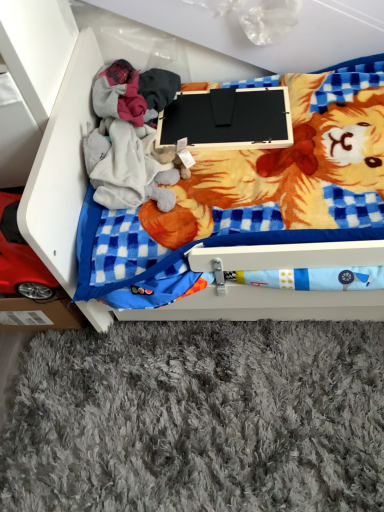
Image resolution: width=384 pixels, height=512 pixels. Find the location of `black matte laptop at center`. black matte laptop at center is located at coordinates (228, 119).

Does black matte laptop at center contain wooden drawer at center?

That's incorrect, wooden drawer at center is not inside black matte laptop at center.

Consider the image. Considering the relative sizes of black matte laptop at center and wooden drawer at center in the image provided, is black matte laptop at center wider than wooden drawer at center?

Result: Incorrect, the width of black matte laptop at center does not surpass that of wooden drawer at center.

Considering the relative sizes of black matte laptop at center and wooden drawer at center in the image provided, is black matte laptop at center shorter than wooden drawer at center?

Indeed, black matte laptop at center has a lesser height compared to wooden drawer at center.

From the picture: From a real-world perspective, is black matte laptop at center under wooden drawer at center?

Incorrect, from a real-world perspective, black matte laptop at center is higher than wooden drawer at center.

Is red plastic toy car at lower left positioned before black matte laptop at center?

Yes, the depth of red plastic toy car at lower left is less than that of black matte laptop at center.

Considering the sizes of objects red plastic toy car at lower left and black matte laptop at center in the image provided, who is shorter, red plastic toy car at lower left or black matte laptop at center?

With less height is black matte laptop at center.

Is black matte laptop at center in front of or behind red plastic toy car at lower left in the image?

In the image, black matte laptop at center appears behind red plastic toy car at lower left.

Find the location of a particular element. This screenshot has width=384, height=512. toy lying below the black matte laptop at center (from the image's perspective) is located at coordinates (20, 257).

From a real-world perspective, is black matte laptop at center above or below red plastic toy car at lower left?

Clearly, from a real-world perspective, black matte laptop at center is above red plastic toy car at lower left.

Who is bigger, black matte laptop at center or red plastic toy car at lower left?

With larger size is red plastic toy car at lower left.

Between wooden drawer at center and red plastic toy car at lower left, which one has more height?

wooden drawer at center.

Considering the relative positions of wooden drawer at center and red plastic toy car at lower left in the image provided, is wooden drawer at center to the right of red plastic toy car at lower left from the viewer's perspective?

Yes, wooden drawer at center is to the right of red plastic toy car at lower left.

Is wooden drawer at center not near red plastic toy car at lower left?

They are positioned close to each other.

Is wooden drawer at center located outside red plastic toy car at lower left?

Yes.

Between wooden drawer at center and black matte laptop at center, which one appears on the right side from the viewer's perspective?

wooden drawer at center.

Find the location of a particular element. The height and width of the screenshot is (512, 384). laptop positioned vertically above the wooden drawer at center (from a real-world perspective) is located at coordinates (228, 119).

Is wooden drawer at center beside black matte laptop at center?

wooden drawer at center is not next to black matte laptop at center, and they're not touching.

Considering the sizes of wooden drawer at center and black matte laptop at center in the image, is wooden drawer at center bigger or smaller than black matte laptop at center?

In the image, wooden drawer at center appears to be larger than black matte laptop at center.

From a real-world perspective, is red plastic toy car at lower left positioned above or below wooden drawer at center?

Clearly, from a real-world perspective, red plastic toy car at lower left is above wooden drawer at center.

Between red plastic toy car at lower left and wooden drawer at center, which one has smaller width?

red plastic toy car at lower left is thinner.

Does red plastic toy car at lower left have a greater height compared to wooden drawer at center?

No, red plastic toy car at lower left is not taller than wooden drawer at center.

Where is `laptop behind the wooden drawer at center`? This screenshot has width=384, height=512. laptop behind the wooden drawer at center is located at coordinates (228, 119).

This screenshot has height=512, width=384. What are the coordinates of `laptop above the red plastic toy car at lower left (from a real-world perspective)` in the screenshot? It's located at (228, 119).

In the scene shown: Based on their spatial positions, is black matte laptop at center or red plastic toy car at lower left further from wooden drawer at center?

black matte laptop at center is positioned further to the anchor wooden drawer at center.

Looking at the image, which one is located further to red plastic toy car at lower left, black matte laptop at center or wooden drawer at center?

The object further to red plastic toy car at lower left is black matte laptop at center.

When comparing their distances from black matte laptop at center, does red plastic toy car at lower left or wooden drawer at center seem closer?

wooden drawer at center is positioned closer to the anchor black matte laptop at center.

Which object lies further to the anchor point red plastic toy car at lower left, wooden drawer at center or black matte laptop at center?

Among the two, black matte laptop at center is located further to red plastic toy car at lower left.

From the image, which object appears to be nearer to wooden drawer at center, red plastic toy car at lower left or black matte laptop at center?

The object closer to wooden drawer at center is red plastic toy car at lower left.

Which object lies further to the anchor point black matte laptop at center, wooden drawer at center or red plastic toy car at lower left?

red plastic toy car at lower left.

Locate an element on the screen. This screenshot has width=384, height=512. laptop between red plastic toy car at lower left and wooden drawer at center from left to right is located at coordinates (228, 119).